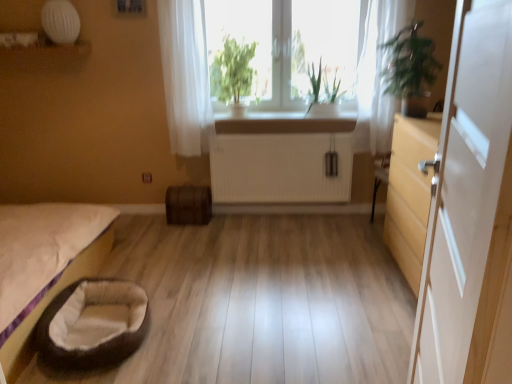
Question: From the image's perspective, is white sheer curtain at upper right, which is the second curtain from left to right, located beneath green leafy plant at center, placed as the 2th plant when sorted from right to left?

Choices:
 (A) yes
 (B) no

Answer: (A)

Question: Is white sheer curtain at upper right, which is the 1th curtain from right to left, wider than green leafy plant at center, positioned as the first plant in left-to-right order?

Choices:
 (A) yes
 (B) no

Answer: (B)

Question: Could green leafy plant at center, positioned as the first plant in left-to-right order, be considered to be inside white sheer curtain at upper right, which is the second curtain from left to right?

Choices:
 (A) yes
 (B) no

Answer: (B)

Question: Considering the relative sizes of white sheer curtain at upper right, which is the 1th curtain from right to left, and green leafy plant at center, placed as the 2th plant when sorted from right to left, in the image provided, is white sheer curtain at upper right, which is the 1th curtain from right to left, thinner than green leafy plant at center, placed as the 2th plant when sorted from right to left,?

Choices:
 (A) yes
 (B) no

Answer: (A)

Question: Considering the relative sizes of white sheer curtain at upper right, which is the second curtain from left to right, and green leafy plant at center, placed as the 2th plant when sorted from right to left, in the image provided, is white sheer curtain at upper right, which is the second curtain from left to right, taller than green leafy plant at center, placed as the 2th plant when sorted from right to left,?

Choices:
 (A) yes
 (B) no

Answer: (A)

Question: From a real-world perspective, is white sheer curtain at upper right, which is the second curtain from left to right, on top of green leafy plant at center, positioned as the first plant in left-to-right order?

Choices:
 (A) no
 (B) yes

Answer: (A)

Question: Considering the relative sizes of white ribbed radiator at center and beige fabric pet bed at lower left in the image provided, is white ribbed radiator at center shorter than beige fabric pet bed at lower left?

Choices:
 (A) no
 (B) yes

Answer: (B)

Question: Is beige fabric pet bed at lower left completely or partially inside white ribbed radiator at center?

Choices:
 (A) no
 (B) yes

Answer: (A)

Question: Does white ribbed radiator at center touch beige fabric pet bed at lower left?

Choices:
 (A) no
 (B) yes

Answer: (A)

Question: Does white ribbed radiator at center have a larger size compared to beige fabric pet bed at lower left?

Choices:
 (A) yes
 (B) no

Answer: (B)

Question: From the image's perspective, does white ribbed radiator at center appear higher than beige fabric pet bed at lower left?

Choices:
 (A) yes
 (B) no

Answer: (A)

Question: Could you tell me if white ribbed radiator at center is turned towards beige fabric pet bed at lower left?

Choices:
 (A) yes
 (B) no

Answer: (B)

Question: From the image's perspective, is white sheer curtain at upper center, the first curtain from the left, beneath green leafy plant at right?

Choices:
 (A) no
 (B) yes

Answer: (A)